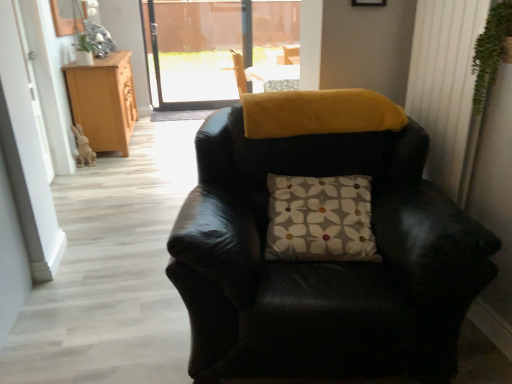
Question: Is the surface of black leather chair at center in direct contact with floral-patterned fabric pillow at center?

Choices:
 (A) no
 (B) yes

Answer: (A)

Question: From a real-world perspective, is black leather chair at center below floral-patterned fabric pillow at center?

Choices:
 (A) yes
 (B) no

Answer: (A)

Question: Can floral-patterned fabric pillow at center be found inside black leather chair at center?

Choices:
 (A) no
 (B) yes

Answer: (B)

Question: Considering the relative sizes of black leather chair at center and floral-patterned fabric pillow at center in the image provided, is black leather chair at center shorter than floral-patterned fabric pillow at center?

Choices:
 (A) yes
 (B) no

Answer: (B)

Question: From a real-world perspective, is black leather chair at center on floral-patterned fabric pillow at center?

Choices:
 (A) yes
 (B) no

Answer: (B)

Question: Is black leather chair at center not near floral-patterned fabric pillow at center?

Choices:
 (A) no
 (B) yes

Answer: (A)

Question: Is green leafy plant at upper right in front of light brown wood cabinet at left?

Choices:
 (A) no
 (B) yes

Answer: (B)

Question: Is light brown wood cabinet at left inside green leafy plant at upper right?

Choices:
 (A) yes
 (B) no

Answer: (B)

Question: Is the depth of green leafy plant at upper right greater than that of light brown wood cabinet at left?

Choices:
 (A) yes
 (B) no

Answer: (B)

Question: Is green leafy plant at upper right oriented away from light brown wood cabinet at left?

Choices:
 (A) yes
 (B) no

Answer: (B)

Question: Can you confirm if green leafy plant at upper right is wider than light brown wood cabinet at left?

Choices:
 (A) yes
 (B) no

Answer: (B)

Question: Does green leafy plant at upper right turn towards light brown wood cabinet at left?

Choices:
 (A) yes
 (B) no

Answer: (B)

Question: From the image's perspective, would you say black leather chair at center is positioned over light brown wood cabinet at left?

Choices:
 (A) yes
 (B) no

Answer: (B)